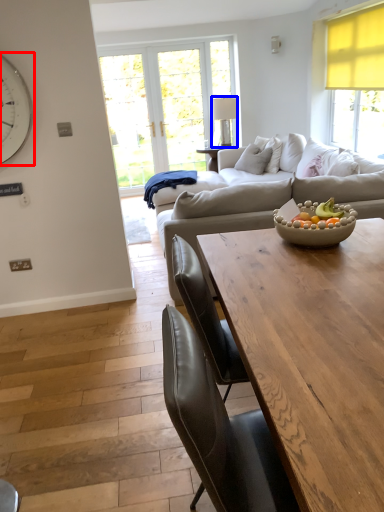
Question: Among these objects, which one is nearest to the camera, clock (highlighted by a red box) or lamp (highlighted by a blue box)?

Choices:
 (A) clock
 (B) lamp

Answer: (A)